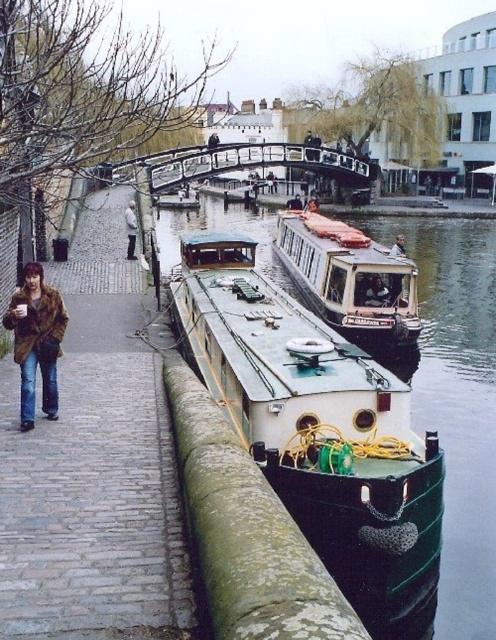
Question: Considering the real-world distances, which object is closest to the matte black jacket at center?

Choices:
 (A) green rubber boat at lower left
 (B) brown fur coat at left

Answer: (A)

Question: Which point appears farthest from the camera in this image?

Choices:
 (A) (201, 369)
 (B) (61, 352)

Answer: (A)

Question: Which point is closer to the camera?

Choices:
 (A) green rubber boat at lower left
 (B) matte black jacket at center

Answer: (A)

Question: Is white glossy houseboat at center to the right of matte black jacket at center from the viewer's perspective?

Choices:
 (A) yes
 (B) no

Answer: (B)

Question: Can you confirm if brown fur coat at left is positioned below matte black jacket at center?

Choices:
 (A) yes
 (B) no

Answer: (A)

Question: Does brown fur coat at left appear over light brown fur coat at left?

Choices:
 (A) no
 (B) yes

Answer: (A)